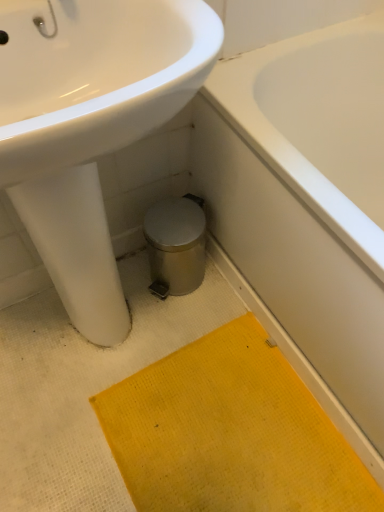
Locate an element on the screen. free point to the right of white glossy sink at upper left is located at coordinates (245, 397).